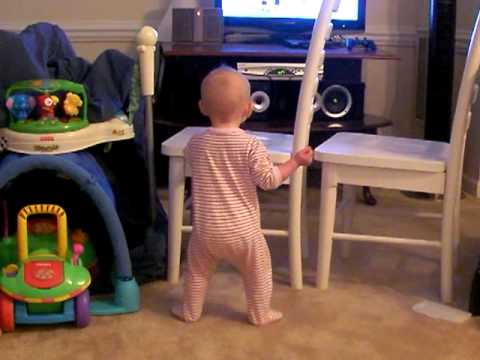
The image size is (480, 360). I want to click on floor, so click(299, 329).